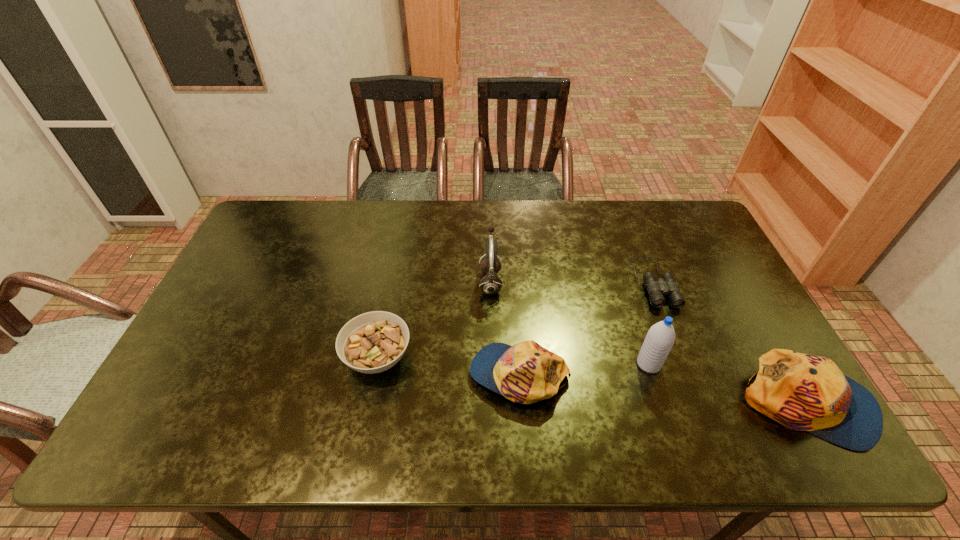
The width and height of the screenshot is (960, 540). Identify the location of free spot between the second shortest object and the fourth shortest object. (592, 381).

Find the location of a particular element. vacant space in between the leftmost object and the earphone is located at coordinates (434, 320).

Locate an element on the screen. This screenshot has height=540, width=960. free space between the second object from right to left and the shorter cap is located at coordinates (587, 328).

At what (x,y) coordinates should I click in order to perform the action: click on vacant point located between the leftmost object and the shortest object. Please return your answer as a coordinate pair (x, y). The width and height of the screenshot is (960, 540). Looking at the image, I should click on pyautogui.click(x=516, y=319).

Find the location of `vacant space in between the third object from right to left and the shorter cap`. vacant space in between the third object from right to left and the shorter cap is located at coordinates (584, 369).

The width and height of the screenshot is (960, 540). What are the coordinates of `vacant point located between the left cap and the earphone` in the screenshot? It's located at (505, 328).

Locate which object is the third closest to the shortest object. Please provide its 2D coordinates. Your answer should be formatted as a tuple, i.e. [(x, y)], where the tuple contains the x and y coordinates of a point satisfying the conditions above.

[(525, 373)]

This screenshot has width=960, height=540. What are the coordinates of `the fifth closest object to the earphone` in the screenshot? It's located at (804, 392).

Identify the location of free location that satisfies the following two spatial constraints: 1. on the ear pads of the earphone; 2. on the right side of the water bottle. (492, 364).

Where is `free space that satisfies the following two spatial constraints: 1. on the ear pads of the third object from right to left; 2. on the right side of the earphone`? The image size is (960, 540). free space that satisfies the following two spatial constraints: 1. on the ear pads of the third object from right to left; 2. on the right side of the earphone is located at coordinates (492, 364).